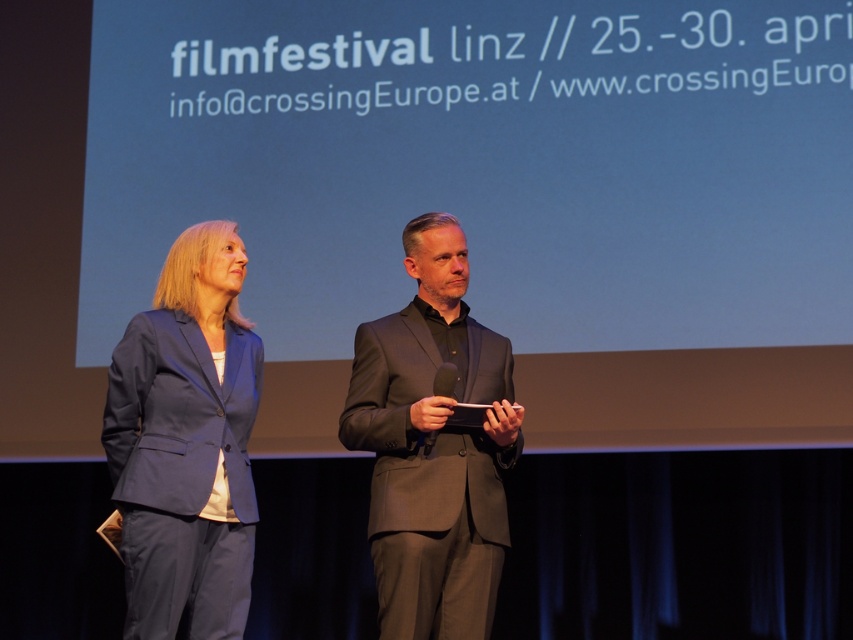
In the scene shown: Does matte blue suit at left have a greater height compared to matte black suit at center?

No, matte blue suit at left is not taller than matte black suit at center.

Where is `matte blue suit at left`? matte blue suit at left is located at coordinates (186, 444).